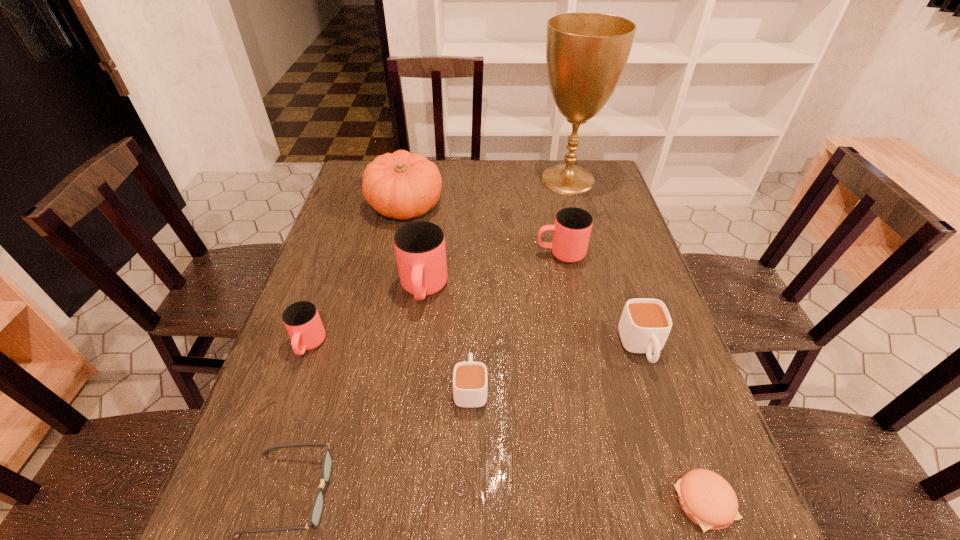
At what (x,y) coordinates should I click in order to perform the action: click on free space that satisfies the following two spatial constraints: 1. on the front side of the tallest object; 2. on the right side of the patty. Please return your answer as a coordinate pair (x, y). This screenshot has height=540, width=960. Looking at the image, I should click on coord(654,503).

Where is `free space that satisfies the following two spatial constraints: 1. on the face of the spectacles; 2. on the back side of the patty`? The image size is (960, 540). free space that satisfies the following two spatial constraints: 1. on the face of the spectacles; 2. on the back side of the patty is located at coordinates (287, 503).

The height and width of the screenshot is (540, 960). In order to click on vacant space that satisfies the following two spatial constraints: 1. on the handle side of the farthest cup; 2. on the back side of the trophy cup in this screenshot , I will do `click(545, 179)`.

What are the coordinates of `blank area in the image that satisfies the following two spatial constraints: 1. on the face of the gray spectacles; 2. on the back side of the patty` in the screenshot? It's located at (287, 503).